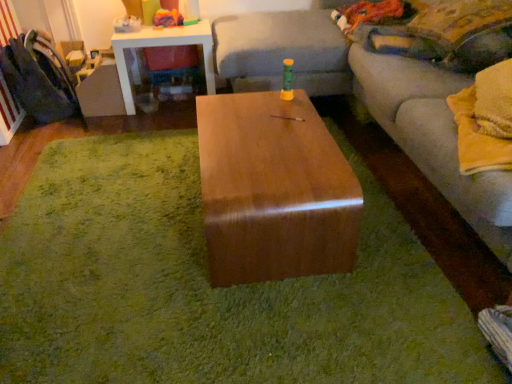
Find the location of a particular element. Image resolution: width=512 pixels, height=384 pixels. vacant position to the left of shiny brown wood coffee table at center is located at coordinates (121, 210).